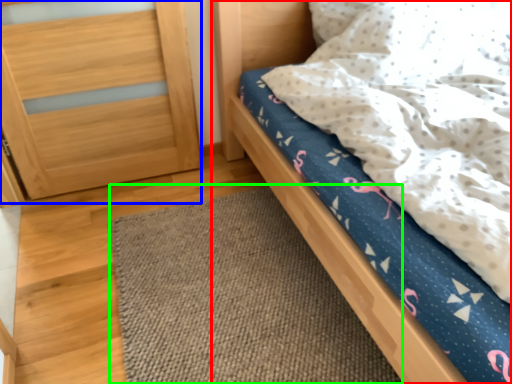
Question: Considering the real-world distances, which object is farthest from bed (highlighted by a red box)? balustrade (highlighted by a blue box) or mat (highlighted by a green box)?

Choices:
 (A) balustrade
 (B) mat

Answer: (A)